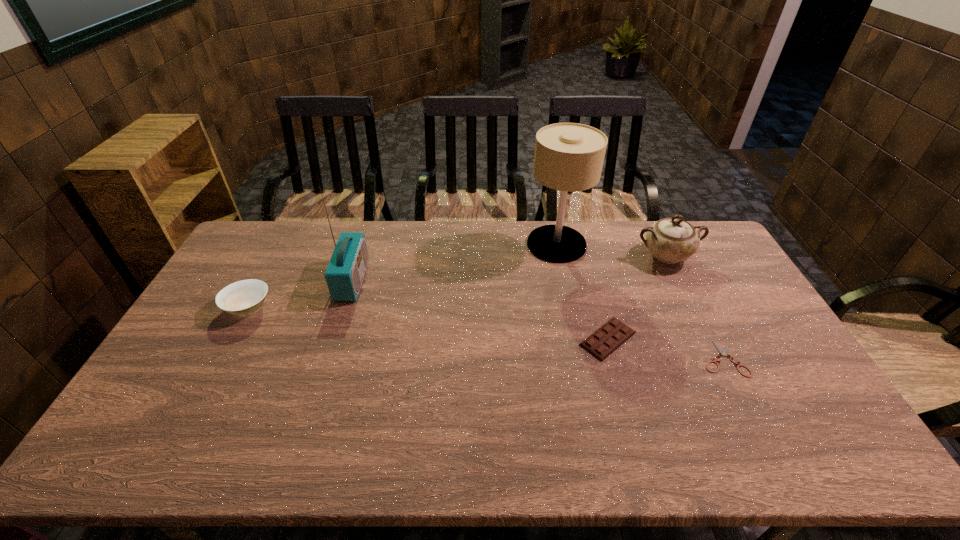
Where is `vacant position in the image that satisfies the following two spatial constraints: 1. on the front panel of the chocolate bar; 2. on the left side of the radio receiver`? The image size is (960, 540). vacant position in the image that satisfies the following two spatial constraints: 1. on the front panel of the chocolate bar; 2. on the left side of the radio receiver is located at coordinates (334, 339).

Where is `vacant region that satisfies the following two spatial constraints: 1. on the front side of the tallest object; 2. on the right side of the third tallest object`? vacant region that satisfies the following two spatial constraints: 1. on the front side of the tallest object; 2. on the right side of the third tallest object is located at coordinates pyautogui.click(x=559, y=256).

The height and width of the screenshot is (540, 960). What are the coordinates of `vacant position in the image that satisfies the following two spatial constraints: 1. on the front panel of the fifth shortest object; 2. on the back side of the second shortest object` in the screenshot? It's located at [334, 339].